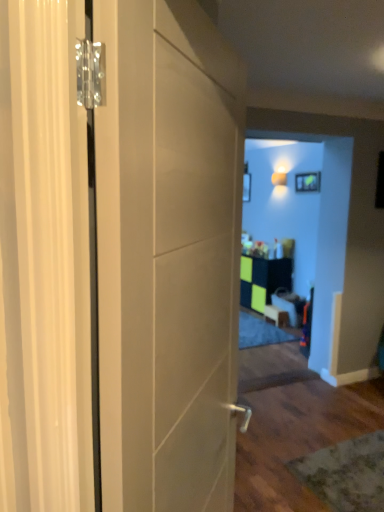
Question: Does green matte cabinet at center have a larger size compared to matte green picture frame at upper center?

Choices:
 (A) no
 (B) yes

Answer: (B)

Question: Can you confirm if green matte cabinet at center is taller than matte green picture frame at upper center?

Choices:
 (A) yes
 (B) no

Answer: (A)

Question: Does green matte cabinet at center have a greater width compared to matte green picture frame at upper center?

Choices:
 (A) no
 (B) yes

Answer: (B)

Question: From a real-world perspective, is green matte cabinet at center physically below matte green picture frame at upper center?

Choices:
 (A) yes
 (B) no

Answer: (A)

Question: Considering the relative sizes of green matte cabinet at center and matte green picture frame at upper center in the image provided, is green matte cabinet at center shorter than matte green picture frame at upper center?

Choices:
 (A) yes
 (B) no

Answer: (B)

Question: Looking at their shapes, would you say wooden table at center, which ranks as the second furniture in left-to-right order, is wider or thinner than matte green picture frame at upper center?

Choices:
 (A) wide
 (B) thin

Answer: (A)

Question: Is wooden table at center, the 1th furniture viewed from the right, bigger or smaller than matte green picture frame at upper center?

Choices:
 (A) big
 (B) small

Answer: (A)

Question: From the image's perspective, relative to matte green picture frame at upper center, is wooden table at center, the 1th furniture viewed from the right, above or below?

Choices:
 (A) below
 (B) above

Answer: (A)

Question: Considering the positions of wooden table at center, the 1th furniture viewed from the right, and matte green picture frame at upper center in the image, is wooden table at center, the 1th furniture viewed from the right, taller or shorter than matte green picture frame at upper center?

Choices:
 (A) short
 (B) tall

Answer: (B)

Question: Is green matte cabinet at center taller or shorter than matte white door at left?

Choices:
 (A) tall
 (B) short

Answer: (B)

Question: From a real-world perspective, relative to matte white door at left, is green matte cabinet at center vertically above or below?

Choices:
 (A) above
 (B) below

Answer: (B)

Question: From the image's perspective, is green matte cabinet at center located above or below matte white door at left?

Choices:
 (A) above
 (B) below

Answer: (B)

Question: Is green matte cabinet at center in front of or behind matte white door at left in the image?

Choices:
 (A) front
 (B) behind

Answer: (B)

Question: In terms of height, does matte green picture frame at upper center look taller or shorter compared to green matte cabinet at center?

Choices:
 (A) tall
 (B) short

Answer: (B)

Question: In the image, is matte green picture frame at upper center positioned in front of or behind green matte cabinet at center?

Choices:
 (A) behind
 (B) front

Answer: (B)